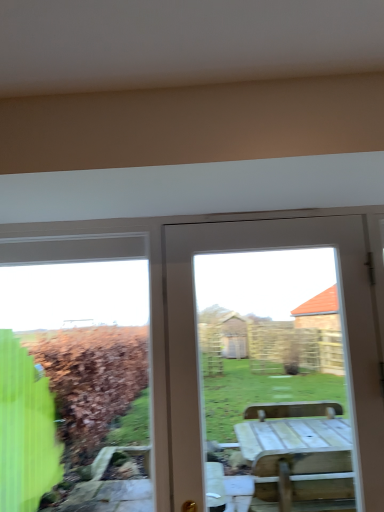
Question: From a real-world perspective, is white wood door at center above or below green glass window at left?

Choices:
 (A) above
 (B) below

Answer: (A)

Question: Based on their positions, is white wood door at center located to the left or right of green glass window at left?

Choices:
 (A) left
 (B) right

Answer: (B)

Question: Is white wood door at center situated inside green glass window at left or outside?

Choices:
 (A) outside
 (B) inside

Answer: (A)

Question: From the image's perspective, is green glass window at left located above or below white wood door at center?

Choices:
 (A) above
 (B) below

Answer: (B)

Question: Is green glass window at left taller or shorter than white wood door at center?

Choices:
 (A) tall
 (B) short

Answer: (B)

Question: From a real-world perspective, is green glass window at left physically located above or below white wood door at center?

Choices:
 (A) below
 (B) above

Answer: (A)

Question: Considering the positions of green glass window at left and white wood door at center in the image, is green glass window at left wider or thinner than white wood door at center?

Choices:
 (A) wide
 (B) thin

Answer: (B)